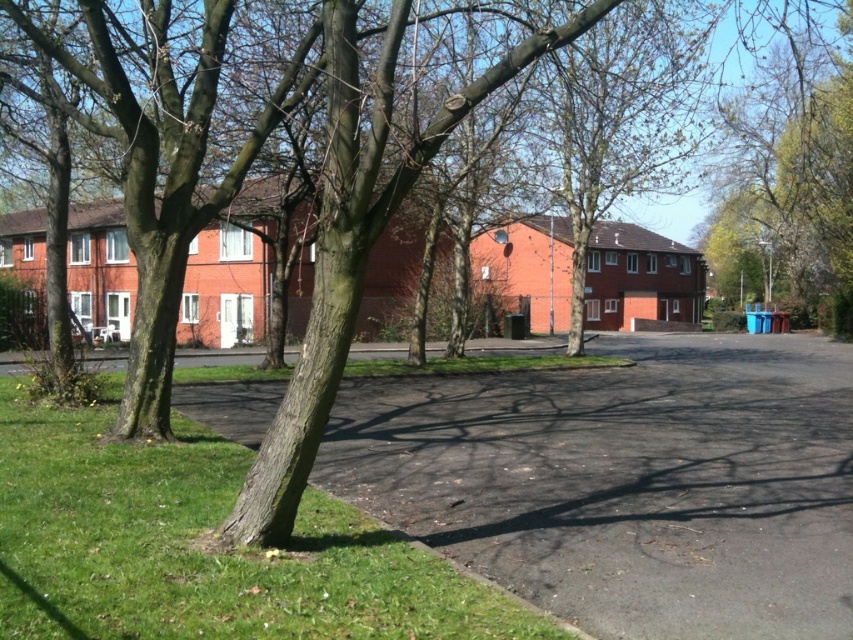
You are a gardener who needs to mow the lawn. You see the green grass at lower left and the green leafy tree at right. Which area requires mowing?

The green grass at lower left requires mowing because it is shorter than the green leafy tree at right, indicating it is the lawn area needing maintenance.